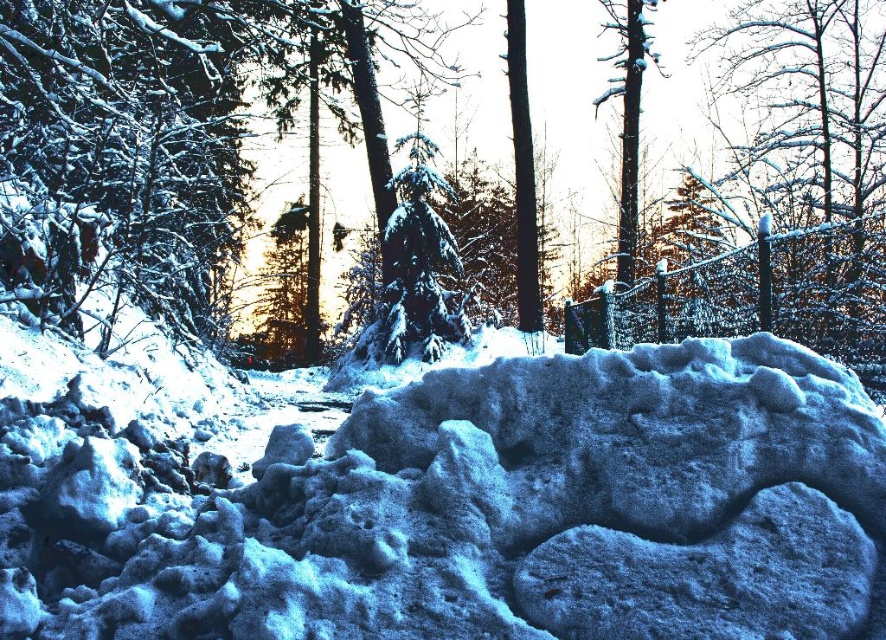
You are an explorer in the winter forest and need to determine which object is taller between the white frosty mound at center and the white frosty tree at upper right. Based on the scene, which one is taller?

The white frosty tree at upper right is taller than the white frosty mound at center.